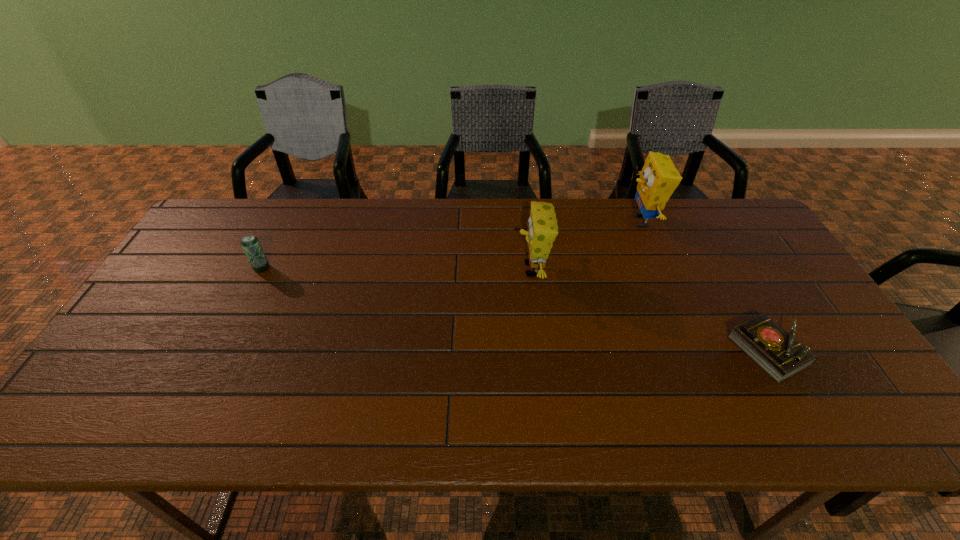
I want to click on vacant space at the near right corner of the desktop, so click(x=868, y=422).

The image size is (960, 540). Identify the location of empty space that is in between the leftmost object and the shortest object. (515, 309).

I want to click on vacant area that lies between the beer can and the rightmost object, so click(515, 309).

Locate an element on the screen. The image size is (960, 540). unoccupied area between the second object from left to right and the second object from right to left is located at coordinates (587, 245).

Where is `free space between the diary and the right sponge`? free space between the diary and the right sponge is located at coordinates (705, 286).

You are a GUI agent. You are given a task and a screenshot of the screen. Output one action in this format:
    pyautogui.click(x=<x>, y=<y>)
    Task: Click on the free space between the right sponge and the beer can
    
    Given the screenshot: What is the action you would take?
    click(x=451, y=245)

This screenshot has height=540, width=960. What are the coordinates of `free spot between the second object from right to left and the beer can` in the screenshot? It's located at (451, 245).

The image size is (960, 540). I want to click on free space between the third object from left to right and the third tallest object, so click(451, 245).

I want to click on free area in between the nearest object and the third object from left to right, so click(x=705, y=286).

Where is `vacant area that lies between the third object from right to left and the rightmost object`? Image resolution: width=960 pixels, height=540 pixels. vacant area that lies between the third object from right to left and the rightmost object is located at coordinates (651, 310).